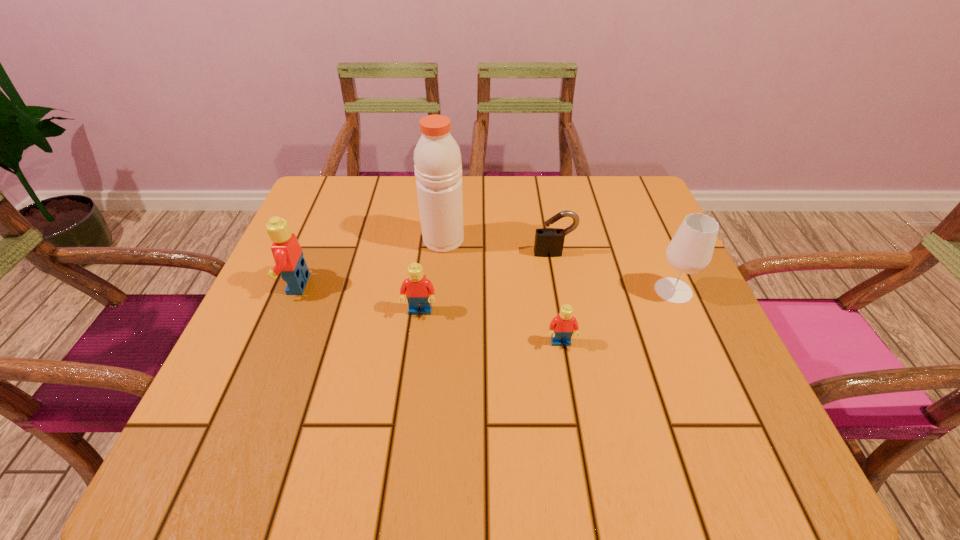
Please point out where to position a new Lego on the right to maintain spacing. Please provide its 2D coordinates. Your answer should be formatted as a tuple, i.e. [(x, y)], where the tuple contains the x and y coordinates of a point satisfying the conditions above.

[(722, 380)]